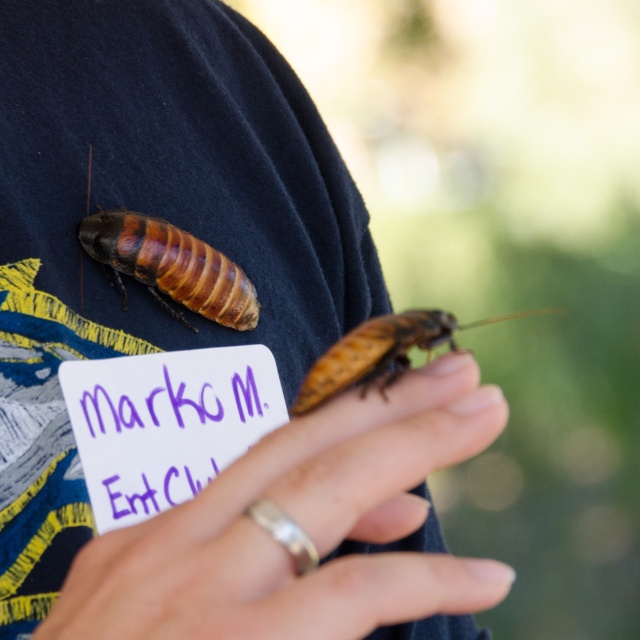
Question: Which point is closer to the camera?

Choices:
 (A) brown shiny cockroach at center
 (B) brown shiny cockroach at upper left

Answer: (A)

Question: Is smooth skin hand at center positioned at the back of brown shiny cockroach at upper left?

Choices:
 (A) yes
 (B) no

Answer: (B)

Question: Which object appears farthest from the camera in this image?

Choices:
 (A) brown shiny cockroach at center
 (B) purple handwritten sign at center
 (C) smooth skin hand at center
 (D) brown shiny cockroach at upper left

Answer: (D)

Question: Which object is the farthest from the purple handwritten sign at center?

Choices:
 (A) brown shiny cockroach at upper left
 (B) brown shiny cockroach at center

Answer: (B)

Question: Does smooth skin hand at center appear on the right side of brown shiny cockroach at upper left?

Choices:
 (A) no
 (B) yes

Answer: (B)

Question: Is brown shiny cockroach at upper left below brown shiny cockroach at center?

Choices:
 (A) yes
 (B) no

Answer: (B)